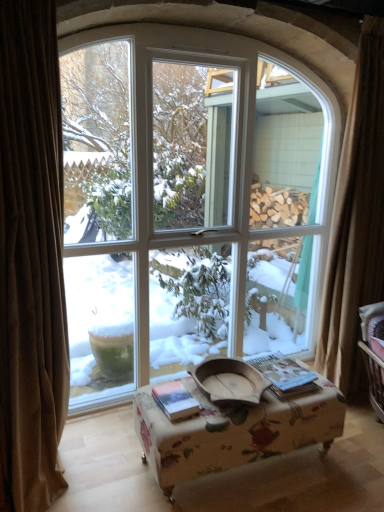
In order to click on free location in front of hardcover book at center, the 2th book in the right-to-left sequence in this screenshot , I will do `click(178, 426)`.